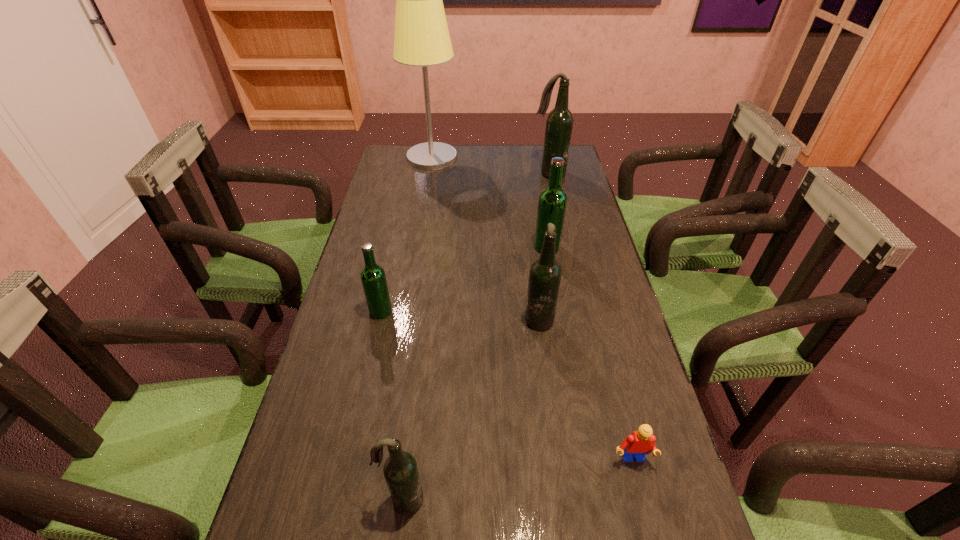
The height and width of the screenshot is (540, 960). In order to click on table lamp in this screenshot , I will do click(422, 38).

Where is `the farthest beer bottle`? This screenshot has height=540, width=960. the farthest beer bottle is located at coordinates (559, 123).

Find the location of `the tallest beer bottle`. the tallest beer bottle is located at coordinates (559, 123).

Where is `the farther green beer bottle`? The image size is (960, 540). the farther green beer bottle is located at coordinates pyautogui.click(x=552, y=203).

At what (x,y) coordinates should I click in order to perform the action: click on the second farthest beer bottle. Please return your answer as a coordinate pair (x, y). This screenshot has height=540, width=960. Looking at the image, I should click on (552, 203).

The image size is (960, 540). I want to click on the second nearest dark beer bottle, so click(x=545, y=273).

At what (x,y) coordinates should I click in order to perform the action: click on the second dark beer bottle from right to left. Please return your answer as a coordinate pair (x, y). Looking at the image, I should click on (545, 273).

Locate an element on the screen. This screenshot has width=960, height=540. the smaller green beer bottle is located at coordinates (373, 277).

Find the location of a particular element. the left green beer bottle is located at coordinates (373, 277).

The height and width of the screenshot is (540, 960). What are the coordinates of `the nearest beer bottle` in the screenshot? It's located at (401, 474).